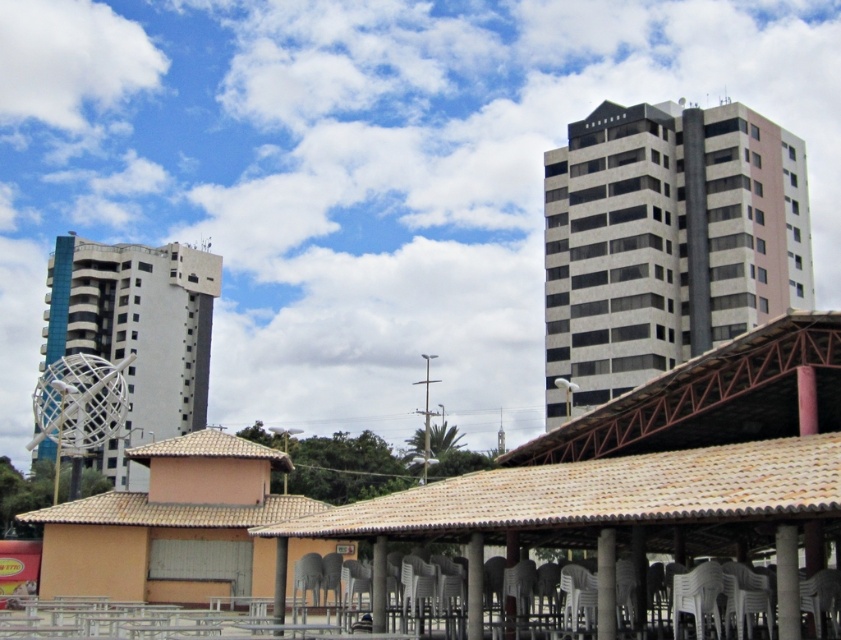
Does point (110, 557) lie in front of point (795, 616)?

No, it is not.

The height and width of the screenshot is (640, 841). Describe the element at coordinates (173, 525) in the screenshot. I see `yellow matte building at lower left` at that location.

Locate an element on the screen. Image resolution: width=841 pixels, height=640 pixels. yellow matte building at lower left is located at coordinates (173, 525).

Can you confirm if white metallic sculpture at left is wider than smooth concrete pillar at center?

Yes, white metallic sculpture at left is wider than smooth concrete pillar at center.

Does white metallic sculpture at left appear over smooth concrete pillar at center?

Actually, white metallic sculpture at left is below smooth concrete pillar at center.

Who is more distant from viewer, (159, 432) or (274, 600)?

The point (159, 432) is more distant.

Where is `white metallic sculpture at left`? Image resolution: width=841 pixels, height=640 pixels. white metallic sculpture at left is located at coordinates (136, 332).

Does white marble building at upper right appear on the right side of yellow matte building at lower left?

Correct, you'll find white marble building at upper right to the right of yellow matte building at lower left.

Is white marble building at upper right shorter than yellow matte building at lower left?

No, white marble building at upper right is not shorter than yellow matte building at lower left.

Is point (680, 296) closer to camera compared to point (204, 497)?

No, it is behind (204, 497).

The width and height of the screenshot is (841, 640). I want to click on white marble building at upper right, so click(x=665, y=241).